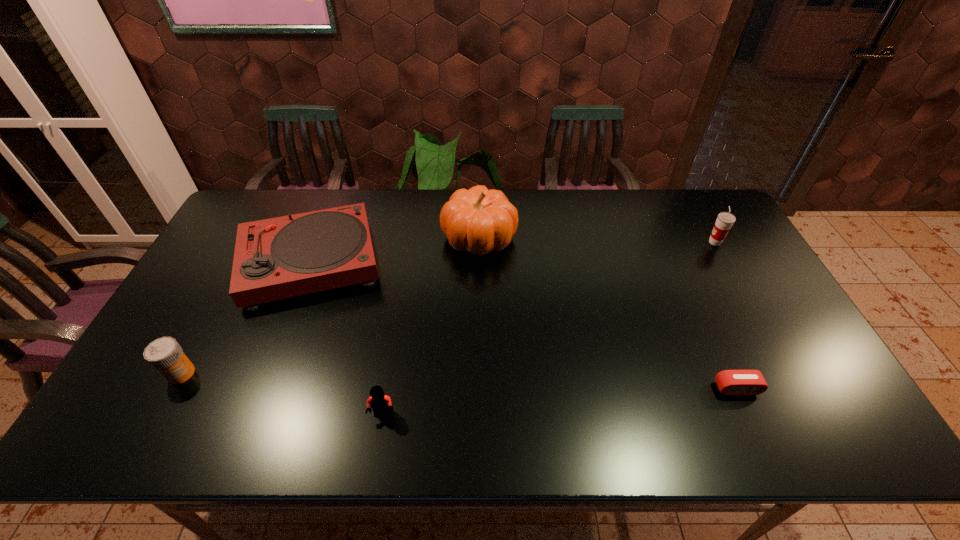
This screenshot has width=960, height=540. I want to click on object located at the near edge, so tap(380, 403).

This screenshot has height=540, width=960. Identify the location of record player present at the left edge. (283, 257).

Image resolution: width=960 pixels, height=540 pixels. In order to click on medicine present at the left edge in this screenshot , I will do `click(165, 354)`.

Find the location of `object present at the right edge`. object present at the right edge is located at coordinates (725, 220).

Find the location of a particular element. This screenshot has height=540, width=960. object that is positioned at the far left corner is located at coordinates (283, 257).

In the image, there is a desktop. Identify the location of free space at the far edge. The height and width of the screenshot is (540, 960). (328, 207).

In the image, there is a desktop. In order to click on vacant space at the near edge in this screenshot , I will do click(x=207, y=422).

What are the coordinates of `free region at the left edge of the desktop` in the screenshot? It's located at (223, 304).

Identify the location of blank space at the right edge. Image resolution: width=960 pixels, height=540 pixels. (710, 274).

This screenshot has width=960, height=540. Find the location of `free space at the far left corner of the desktop`. free space at the far left corner of the desktop is located at coordinates (282, 192).